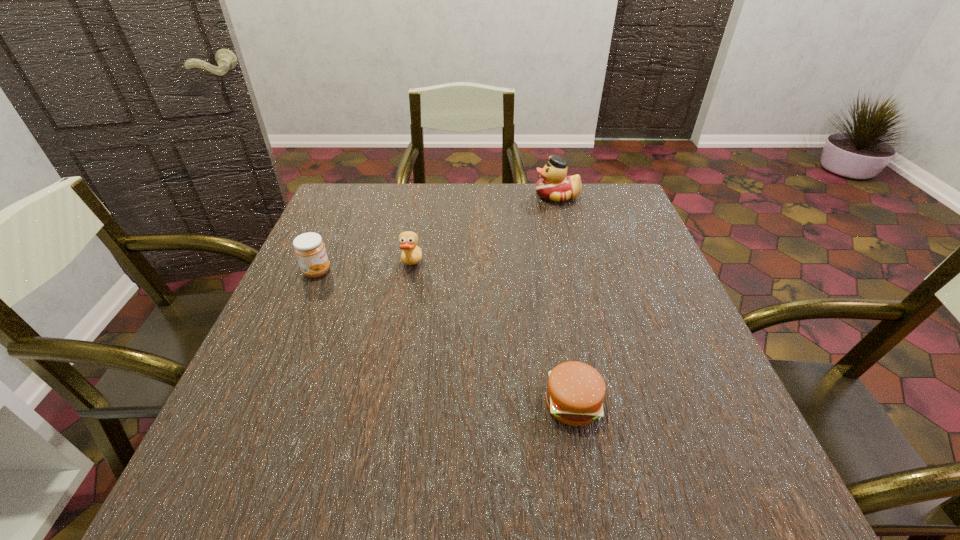
Find the location of a particular element. Image resolution: width=960 pixels, height=540 pixels. free space that is in between the hamburger and the farther duck is located at coordinates (564, 300).

Find the location of a particular element. The image size is (960, 540). vacant region between the second object from left to right and the shortest object is located at coordinates coord(492,335).

Identify the location of free space that is in between the shortest object and the right duck. [x=564, y=300].

The image size is (960, 540). Identify the location of free space that is in between the nearer duck and the farthest object. (484, 231).

Locate which object ranks in proximity to the left duck. Please provide its 2D coordinates. Your answer should be formatted as a tuple, i.e. [(x, y)], where the tuple contains the x and y coordinates of a point satisfying the conditions above.

[(309, 248)]

Choose which object is the nearest neighbor to the jam. Please provide its 2D coordinates. Your answer should be formatted as a tuple, i.e. [(x, y)], where the tuple contains the x and y coordinates of a point satisfying the conditions above.

[(411, 254)]

Image resolution: width=960 pixels, height=540 pixels. Find the location of `vacant point that satisfies the following two spatial constraints: 1. on the beak of the shorter duck; 2. on the left side of the hamburger`. vacant point that satisfies the following two spatial constraints: 1. on the beak of the shorter duck; 2. on the left side of the hamburger is located at coordinates (386, 404).

Find the location of `vacant point that satisfies the following two spatial constraints: 1. on the front label of the jam; 2. on the back side of the nearest object`. vacant point that satisfies the following two spatial constraints: 1. on the front label of the jam; 2. on the back side of the nearest object is located at coordinates (260, 404).

Image resolution: width=960 pixels, height=540 pixels. Find the location of `vacant region that satisfies the following two spatial constraints: 1. on the front label of the jam; 2. on the left side of the shortest object`. vacant region that satisfies the following two spatial constraints: 1. on the front label of the jam; 2. on the left side of the shortest object is located at coordinates (260, 404).

What are the coordinates of `free region that satisfies the following two spatial constraints: 1. on the beak of the nearer duck; 2. on the right side of the shortest object` in the screenshot? It's located at (386, 404).